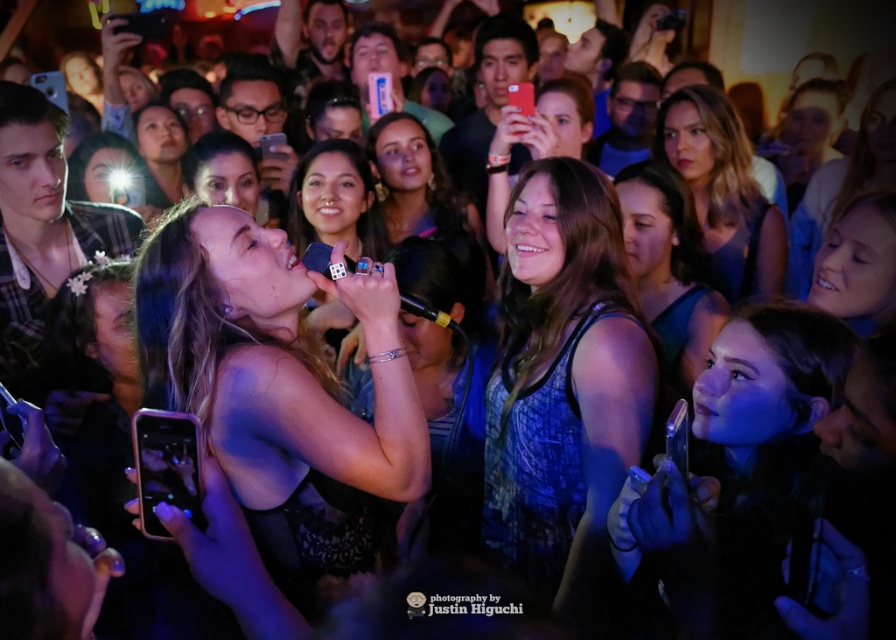
You are a photographer at the concert and want to focus your camera on the matte skin tone face at center. However, the matte blue dress at center is blocking your view. Can you adjust your angle to capture the face without the dress obstructing it?

The matte blue dress at center is closer to the viewer than the matte skin tone face at center, so adjusting the angle might allow you to capture the face without the dress blocking it by moving the camera position slightly to the side or adjusting the lens focus to bring the face into view while the dress remains in the foreground but not directly obstructing the face.

You are at the concert and want to take a photo of the performers. You notice the matte blue dress at center and the matte skin tone face at center. Which one is positioned to the right side of the other?

The matte blue dress at center is to the right of the matte skin tone face at center.

You are at a concert and want to take a photo of the performers. The matte black tank top at center and the matte blue dress at center are both in your camera frame. Based on their positions, which one is more likely to be in focus if you focus on the person wearing the matte black tank top?

The matte black tank top at center is more likely to be in focus since it is closer to the camera than the matte blue dress at center.